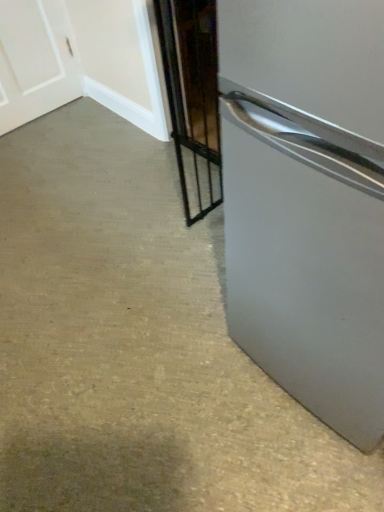
This screenshot has width=384, height=512. In order to click on free space in front of black metal screen door at center in this screenshot , I will do `click(201, 267)`.